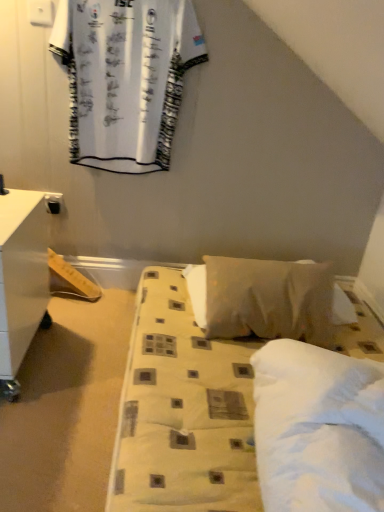
Question: Choose the correct answer: Is white glossy nightstand at left inside white soft pillow at center or outside it?

Choices:
 (A) inside
 (B) outside

Answer: (B)

Question: Relative to white soft pillow at center, is white glossy nightstand at left in front or behind?

Choices:
 (A) behind
 (B) front

Answer: (B)

Question: Which object is the farthest from the white glossy nightstand at left?

Choices:
 (A) white printed fabric at upper left
 (B) white fabric bed at center
 (C) white soft pillow at center

Answer: (C)

Question: Based on their relative distances, which object is nearer to the white printed fabric at upper left?

Choices:
 (A) white fabric bed at center
 (B) white soft pillow at center
 (C) white glossy nightstand at left

Answer: (C)